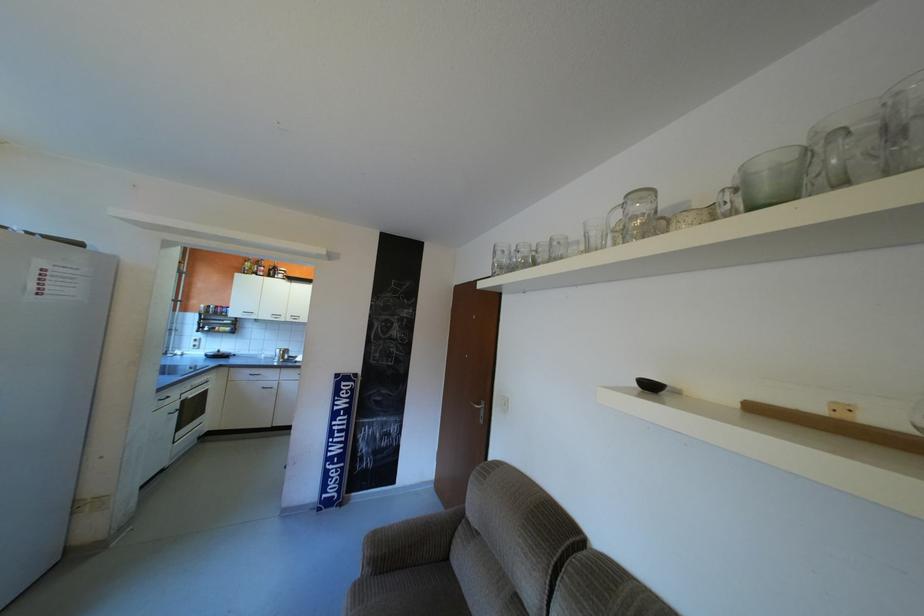
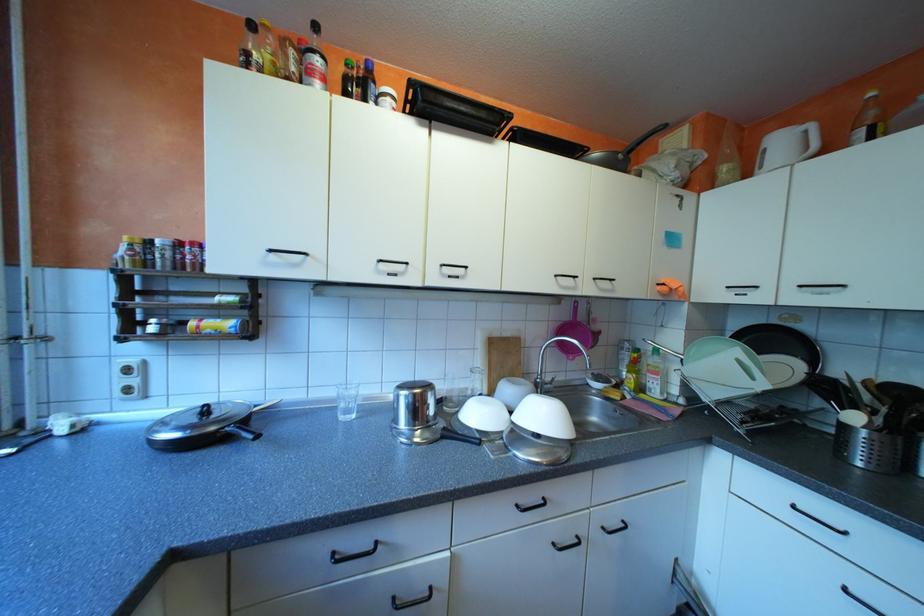
From the picture: What movement of the cameraman would produce the second image?

The cameraman walked toward left, forward.